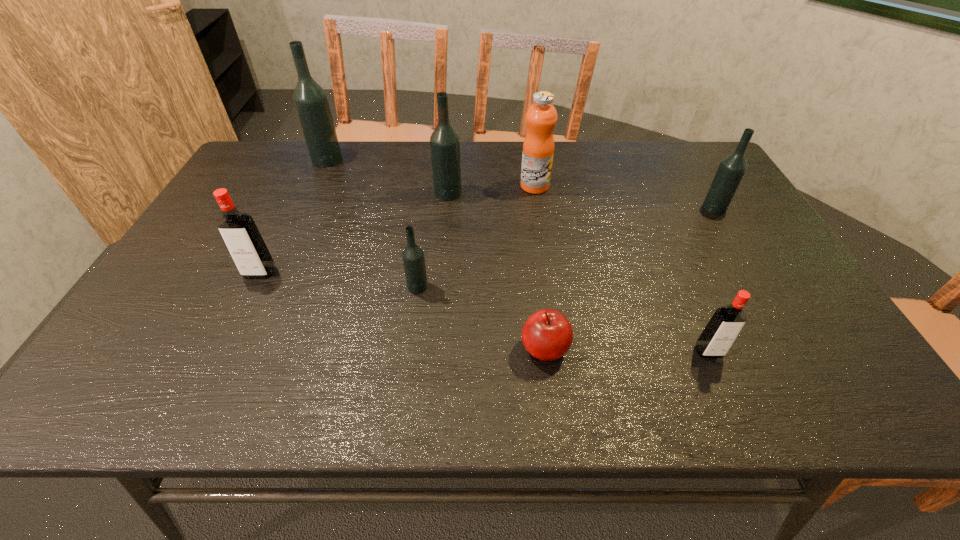
At what (x,y) coordinates should I click in order to perform the action: click on the leftmost black vodka. Please return your answer as a coordinate pair (x, y). The image size is (960, 540). Looking at the image, I should click on (311, 102).

Locate an element on the screen. The image size is (960, 540). the farthest object is located at coordinates (311, 102).

Where is `the second tallest vodka`? the second tallest vodka is located at coordinates (444, 142).

Find the location of `fruit juice`. fruit juice is located at coordinates (538, 148).

Find the location of `the second smallest black vodka`. the second smallest black vodka is located at coordinates (731, 170).

I want to click on the rightmost vodka, so click(x=731, y=170).

What are the coordinates of `the farther red vodka` in the screenshot? It's located at (238, 229).

At what (x,y) coordinates should I click in order to perform the action: click on the bigger red vodka. Please return your answer as a coordinate pair (x, y). Looking at the image, I should click on (238, 229).

At what (x,y) coordinates should I click in order to perform the action: click on the smallest black vodka. Please return your answer as a coordinate pair (x, y). The image size is (960, 540). Looking at the image, I should click on (413, 257).

Locate an element on the screen. the nearer red vodka is located at coordinates (721, 331).